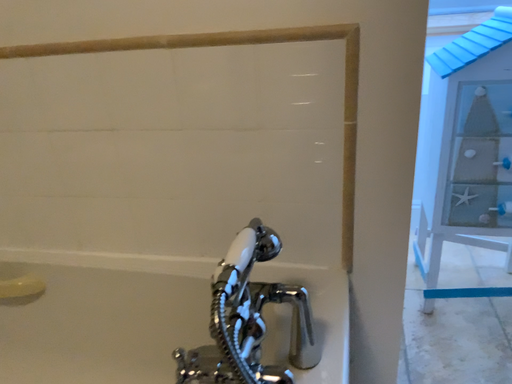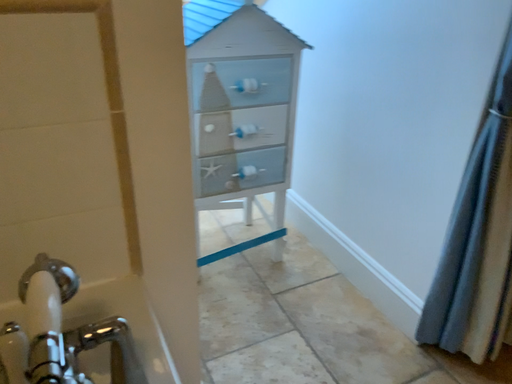
Question: How did the camera likely rotate when shooting the video?

Choices:
 (A) rotated right
 (B) rotated left

Answer: (A)